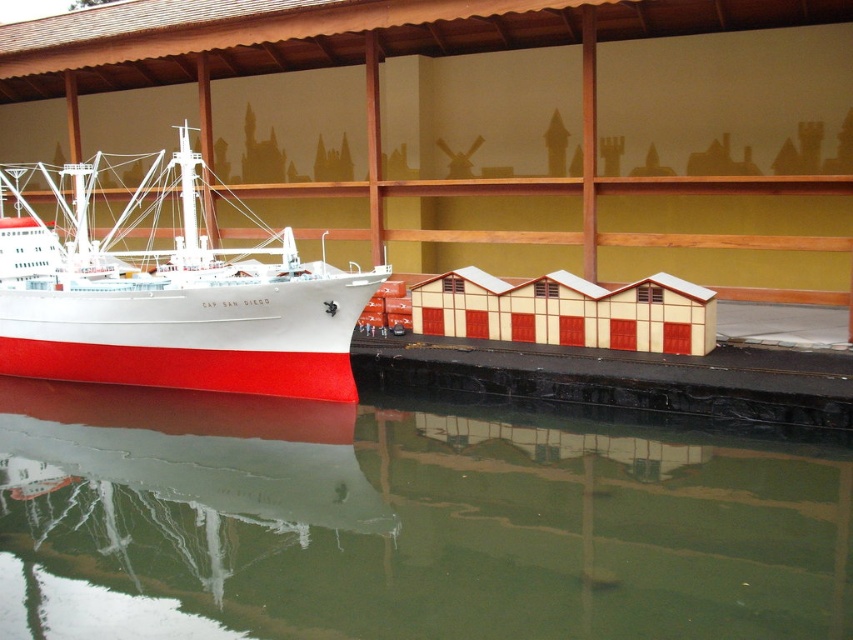
Question: Among these points, which one is farthest from the camera?

Choices:
 (A) (509, 529)
 (B) (416, 340)
 (C) (576, 284)

Answer: (B)

Question: Considering the real-world distances, which object is closest to the white matte ship at left?

Choices:
 (A) beige matte/beige textured building at lower center
 (B) green reflective water at lower center
 (C) black rubber dock at lower center

Answer: (B)

Question: Which point is farther to the camera?

Choices:
 (A) (466, 529)
 (B) (444, 276)

Answer: (B)

Question: Is white matte ship at left smaller than black rubber dock at lower center?

Choices:
 (A) no
 (B) yes

Answer: (A)

Question: Does white matte ship at left appear on the left side of beige matte/beige textured building at lower center?

Choices:
 (A) yes
 (B) no

Answer: (A)

Question: Is green reflective water at lower center positioned before white matte ship at left?

Choices:
 (A) yes
 (B) no

Answer: (A)